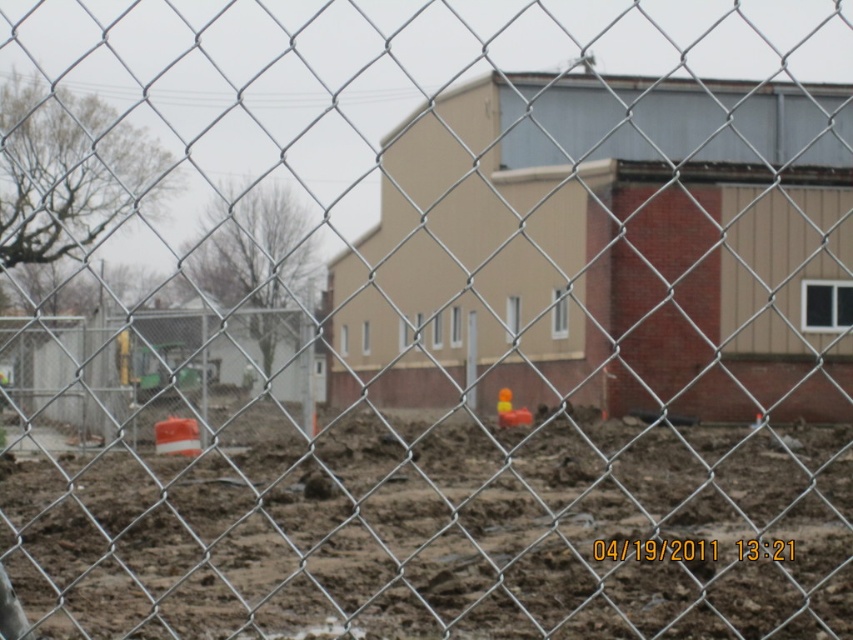
Question: Does brown dirt at center appear on the left side of beige brick building at center?

Choices:
 (A) no
 (B) yes

Answer: (B)

Question: Can you confirm if brown dirt at center is positioned to the right of beige brick building at center?

Choices:
 (A) no
 (B) yes

Answer: (A)

Question: Which object appears closest to the camera in this image?

Choices:
 (A) brown dirt at center
 (B) beige brick building at center

Answer: (B)

Question: Which point is farther from the camera taking this photo?

Choices:
 (A) (796, 381)
 (B) (815, 508)

Answer: (A)

Question: Is brown dirt at center smaller than beige brick building at center?

Choices:
 (A) yes
 (B) no

Answer: (A)